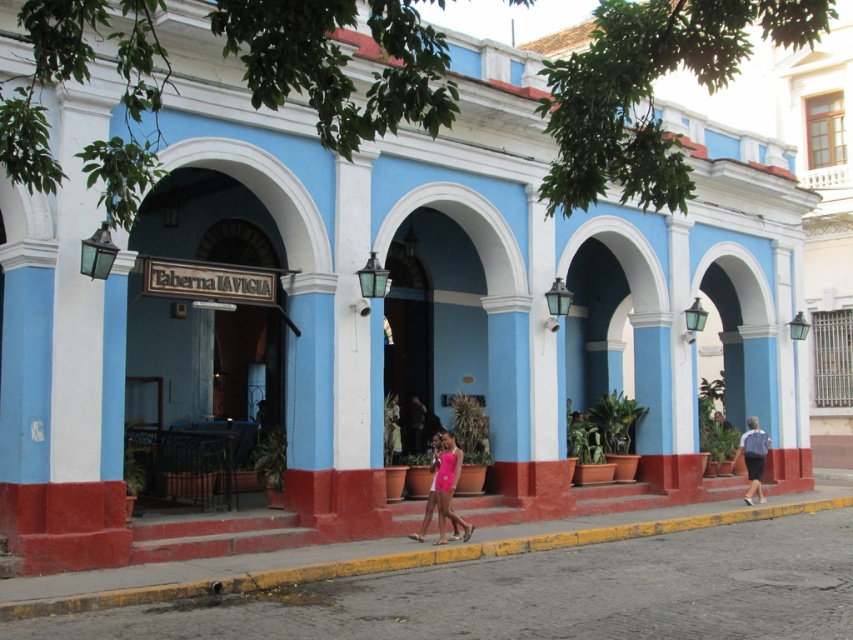
Which is more to the right, yellow asphalt at lower center or light blue shirt at center?

light blue shirt at center is more to the right.

Does yellow asphalt at lower center appear under light blue shirt at center?

Answer: Correct, yellow asphalt at lower center is located below light blue shirt at center.

At what (x,y) coordinates should I click in order to perform the action: click on yellow asphalt at lower center. Please return your answer as a coordinate pair (x, y). The image size is (853, 640). Looking at the image, I should click on [527, 588].

Is point (155, 636) farther from camera compared to point (450, 456)?

No, (155, 636) is closer to viewer.

Which of these two, yellow asphalt at lower center or pink matte dress at center, stands taller?

Standing taller between the two is pink matte dress at center.

What do you see at coordinates (527, 588) in the screenshot?
I see `yellow asphalt at lower center` at bounding box center [527, 588].

The width and height of the screenshot is (853, 640). I want to click on yellow asphalt at lower center, so click(527, 588).

From the picture: Is pink matte dress at center to the left of light blue shirt at center from the viewer's perspective?

Yes, pink matte dress at center is to the left of light blue shirt at center.

Does pink matte dress at center have a greater width compared to light blue shirt at center?

Indeed, pink matte dress at center has a greater width compared to light blue shirt at center.

Is point (467, 525) more distant than point (747, 467)?

No, it is in front of (747, 467).

At what (x,y) coordinates should I click in order to perform the action: click on pink matte dress at center. Please return your answer as a coordinate pair (x, y). Image resolution: width=853 pixels, height=640 pixels. Looking at the image, I should click on (445, 492).